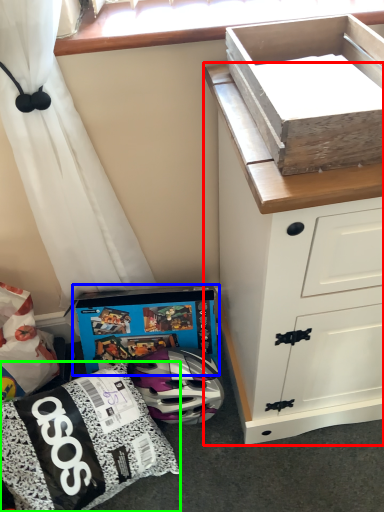
Question: Which is nearer to the chest of drawers (highlighted by a red box)? cardboard box (highlighted by a blue box) or kit (highlighted by a green box).

Choices:
 (A) cardboard box
 (B) kit

Answer: (A)